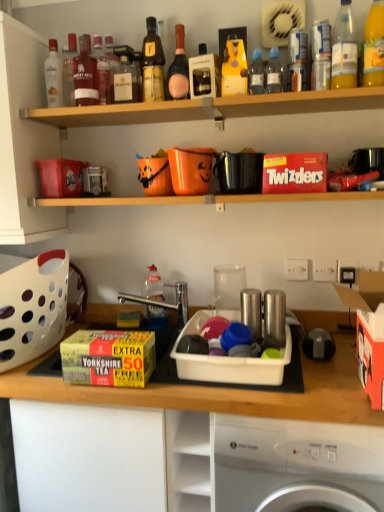
You are a GUI agent. You are given a task and a screenshot of the screen. Output one action in this format:
    pyautogui.click(x=<x>, y=<y>)
    Task: Click on the free spot above white plastic container at center, positioned as the first appliance in bottom-to-top order (from a real-world perspective)
    This screenshot has width=384, height=512.
    Given the screenshot: What is the action you would take?
    pyautogui.click(x=233, y=340)